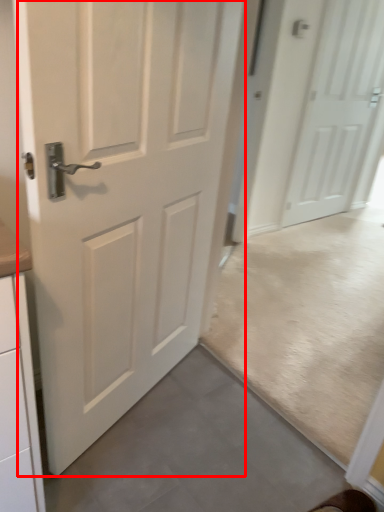
Question: From the image's perspective, considering the relative positions of door (annotated by the red box) and door in the image provided, where is door (annotated by the red box) located with respect to the staircase?

Choices:
 (A) above
 (B) below

Answer: (B)